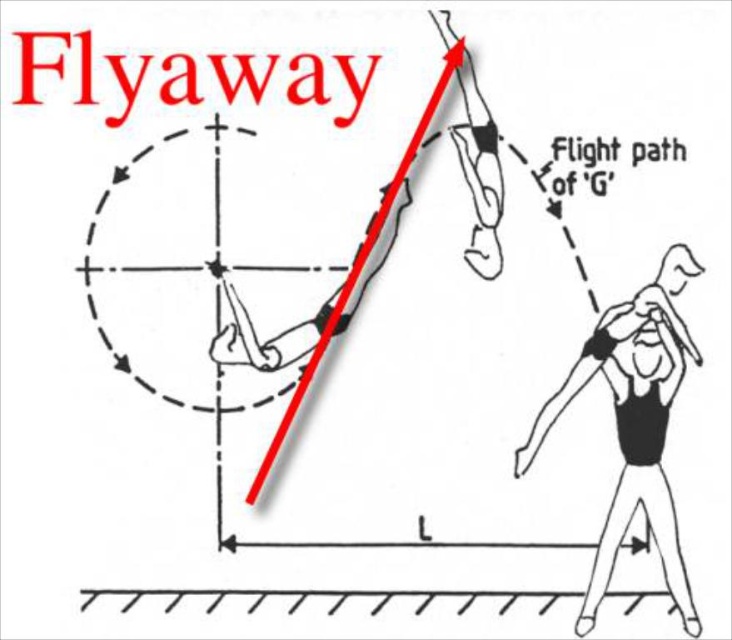
Who is lower down, black matte figure at center or smooth concrete floor at lower center?

smooth concrete floor at lower center

Who is more forward, (600, 556) or (302, 595)?

Point (600, 556) is more forward.

Identify the location of black matte figure at center. (632, 424).

The width and height of the screenshot is (732, 640). I want to click on black matte figure at center, so click(632, 424).